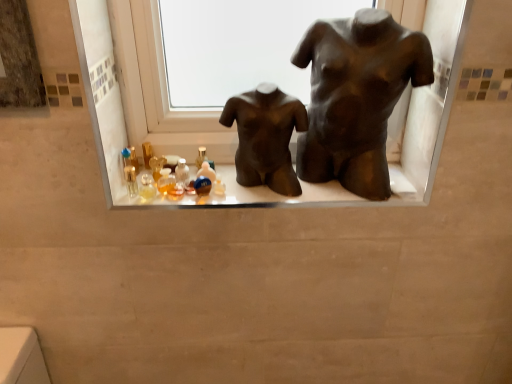
Locate an element on the screen. The image size is (512, 384). blank space situated above matte black mannequins at center (from a real-world perspective) is located at coordinates (246, 183).